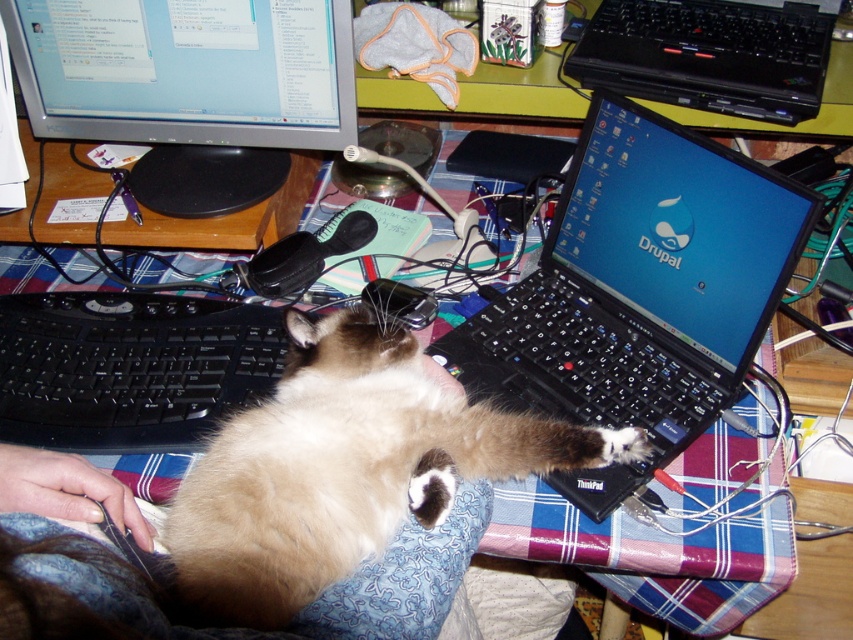
In the scene shown: You are a remote worker who needs to access a document displayed on the silver metallic monitor at upper left. However, you notice the black plastic laptop at center is blocking your view. Can you move the laptop to see the monitor clearly?

The black plastic laptop at center is in front of the silver metallic monitor at upper left, so moving it would allow you to see the monitor clearly.

You need to place a new wireless mouse that is 15 cm long on the desk. Considering the black plastic laptop at center and the silver metallic monitor at upper left, which object has enough space next to it to accommodate the mouse?

The silver metallic monitor at upper left has enough space next to it to accommodate the mouse since it is wider than the black plastic laptop at center.

Please describe the location of the point marked at coordinates (189, 88) in the image. Which object is it located on and where on that object?

The point marked at coordinates (189, 88) is located on the silver metallic monitor at upper left, specifically on its upper portion.